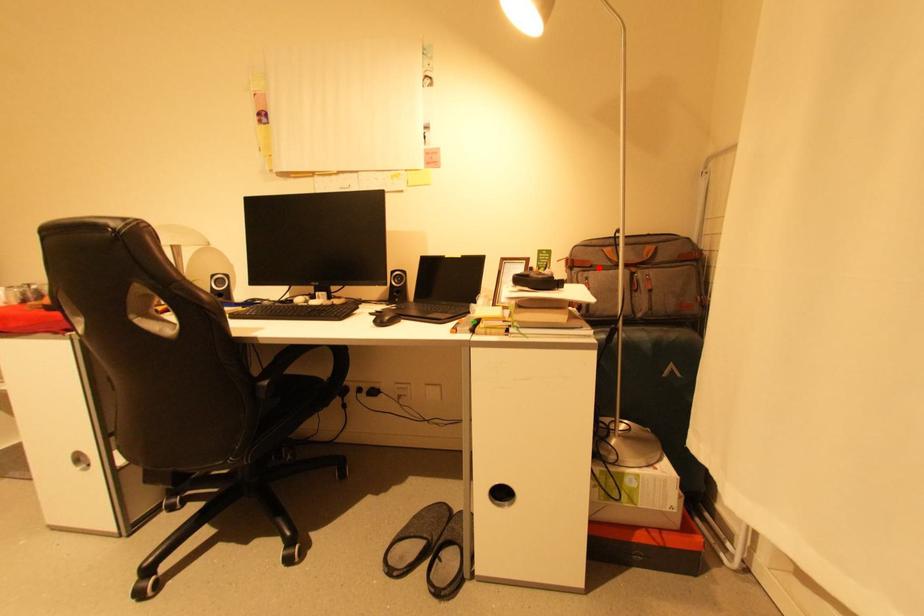
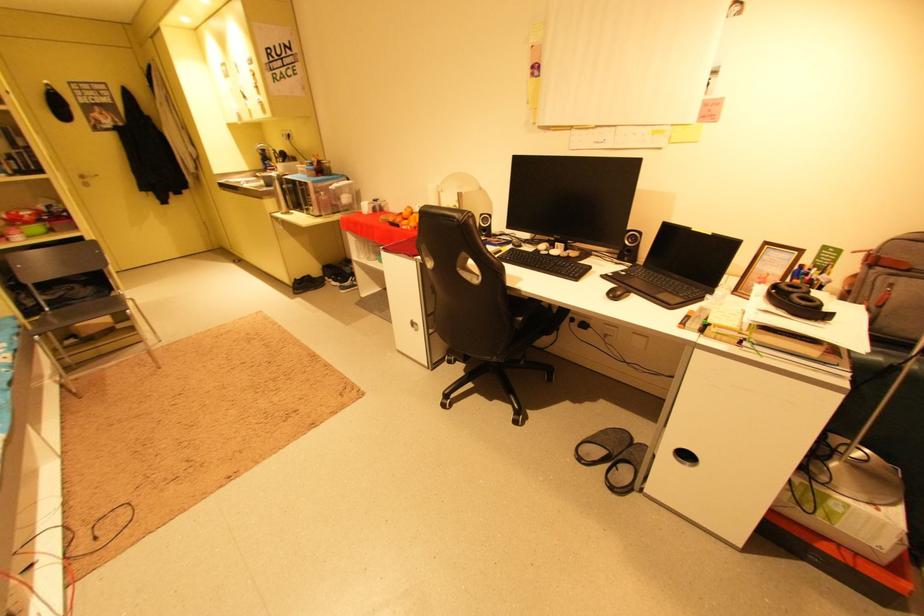
Question: I am providing you with two images of the same scene from different viewpoints. In image1, a red point is highlighted. Considering the same 3D point in image2, which of the following is correct?

Choices:
 (A) It is closer
 (B) It is farther

Answer: (B)